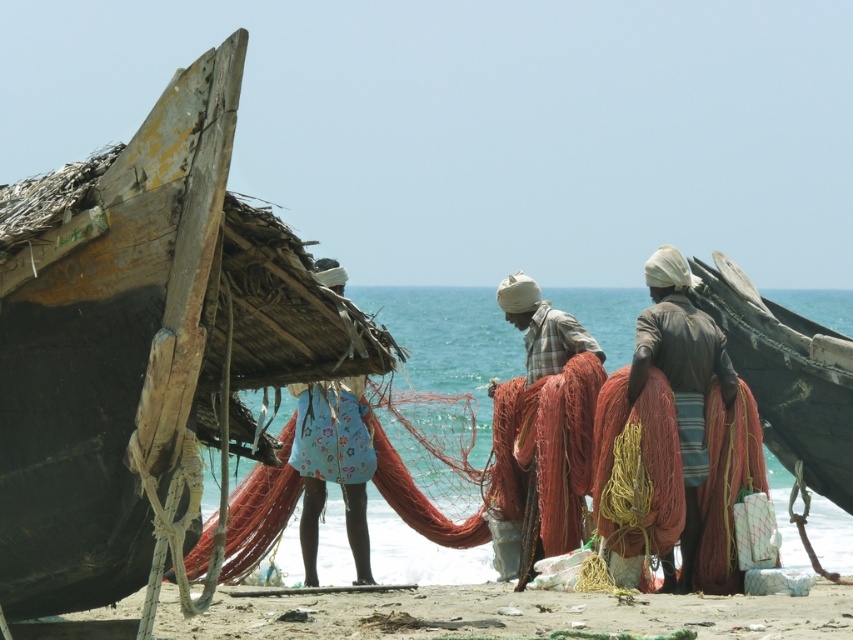
Which is below, translucent water at center or rustic woven net at center?

translucent water at center is below.

Does translucent water at center appear under rustic woven net at center?

Yes.

Which is in front, point (395, 385) or point (523, 317)?

Point (523, 317) is in front.

This screenshot has width=853, height=640. In order to click on translucent water at center in this screenshot , I will do tap(450, 340).

Does weathered wood boat at left have a larger size compared to translucent water at center?

Actually, weathered wood boat at left might be smaller than translucent water at center.

Find the location of a particular element. weathered wood boat at left is located at coordinates (146, 349).

In the scene shown: Between wooden boat at right and rustic woven net at center, which one has more height?

With more height is rustic woven net at center.

Which is below, wooden boat at right or rustic woven net at center?

Positioned lower is rustic woven net at center.

Locate an element on the screen. wooden boat at right is located at coordinates (788, 380).